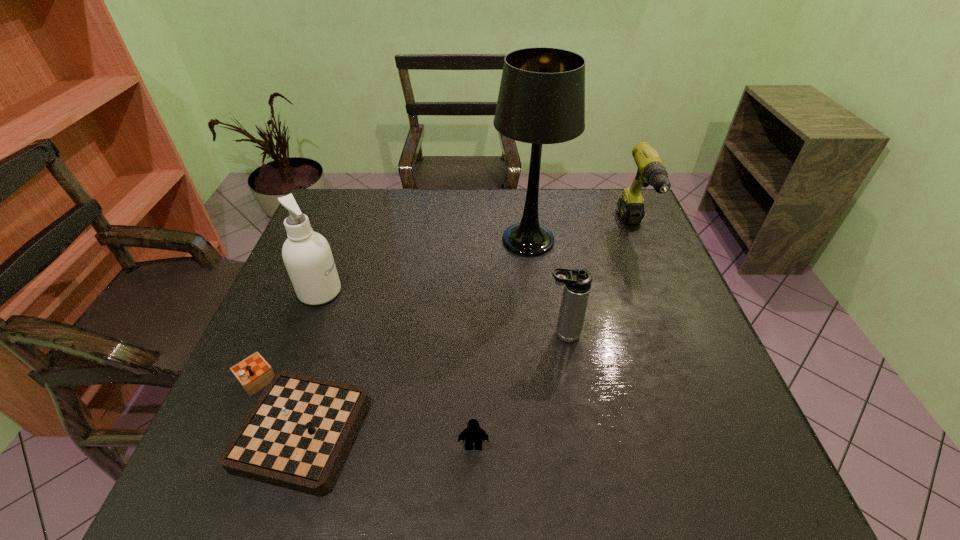
The width and height of the screenshot is (960, 540). In order to click on free space located on the front label of the cleansing agent in this screenshot , I will do pyautogui.click(x=470, y=292).

Identify the location of free space located on the handle side of the fourth shortest object. (665, 303).

At what (x,y) coordinates should I click in order to perform the action: click on free space located on the handle side of the fourth tallest object. Please return your answer as a coordinate pair (x, y). The width and height of the screenshot is (960, 540). Looking at the image, I should click on (465, 334).

This screenshot has width=960, height=540. What are the coordinates of `free space located 0.250m on the handle side of the fourth tallest object` in the screenshot? It's located at (440, 334).

Locate an element on the screen. The width and height of the screenshot is (960, 540). vacant space located on the handle side of the fourth tallest object is located at coordinates (444, 334).

The height and width of the screenshot is (540, 960). In order to click on vacant space positioned 0.060m on the face of the fifth tallest object in this screenshot , I will do `click(473, 483)`.

Identify the location of free space located 0.260m on the back of the chessboard. (338, 283).

At what (x,y) coordinates should I click in order to perform the action: click on table lamp present at the far edge. Please return your answer as a coordinate pair (x, y). Looking at the image, I should click on (541, 100).

Locate an element on the screen. The width and height of the screenshot is (960, 540). drill that is at the far edge is located at coordinates (651, 171).

At what (x,y) coordinates should I click in order to perform the action: click on Lego present at the near edge. Please return your answer as a coordinate pair (x, y). Looking at the image, I should click on (473, 433).